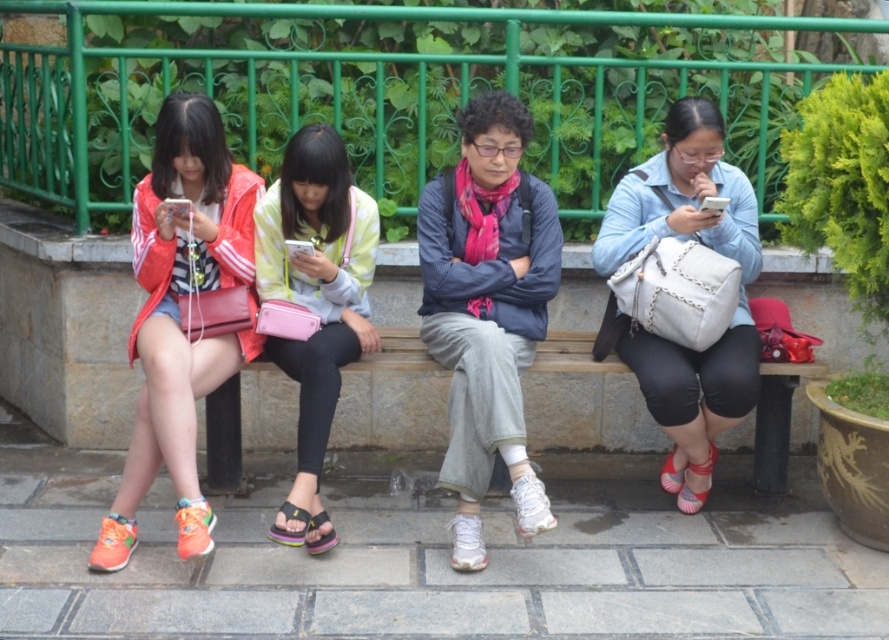
You are a tailor trying to determine if the matte blue jacket at center can be folded and placed inside the black fabric sandal at lower center. Based on their sizes, what would you conclude?

The matte blue jacket at center has a larger width than the black fabric sandal at lower center, so it cannot be folded and placed inside the sandal.